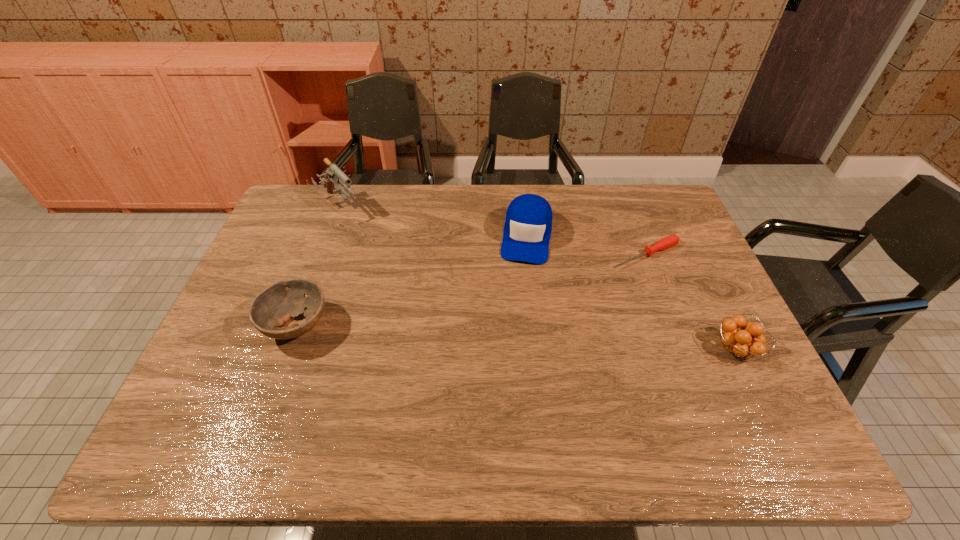
Identify the location of gun at the left edge. This screenshot has width=960, height=540. (333, 174).

Where is `orange fruit that is at the right edge`? The height and width of the screenshot is (540, 960). orange fruit that is at the right edge is located at coordinates (737, 342).

Locate an element on the screen. screwdriver that is at the right edge is located at coordinates (671, 240).

Identify the location of object that is positioned at the far left corner. The width and height of the screenshot is (960, 540). (333, 174).

Find the location of a particular element. Image resolution: width=960 pixels, height=540 pixels. vacant space at the far edge of the desktop is located at coordinates (420, 217).

In the image, there is a desktop. At what (x,y) coordinates should I click in order to perform the action: click on free space at the left edge. Please return your answer as a coordinate pair (x, y). Looking at the image, I should click on (228, 367).

You are a GUI agent. You are given a task and a screenshot of the screen. Output one action in this format:
    pyautogui.click(x=<x>, y=<y>)
    Task: Click on the free space at the right edge of the desktop
    The image size is (960, 540).
    Given the screenshot: What is the action you would take?
    (x=673, y=246)

In the image, there is a desktop. Where is `vacant area at the far left corner`? vacant area at the far left corner is located at coordinates (300, 207).

At what (x,y) coordinates should I click in order to perform the action: click on free point at the far right corner. Please return your answer as a coordinate pair (x, y). The width and height of the screenshot is (960, 540). Looking at the image, I should click on (675, 207).

Find the location of a particular element. Image resolution: width=960 pixels, height=540 pixels. vacant space at the near right corner of the desktop is located at coordinates (738, 379).